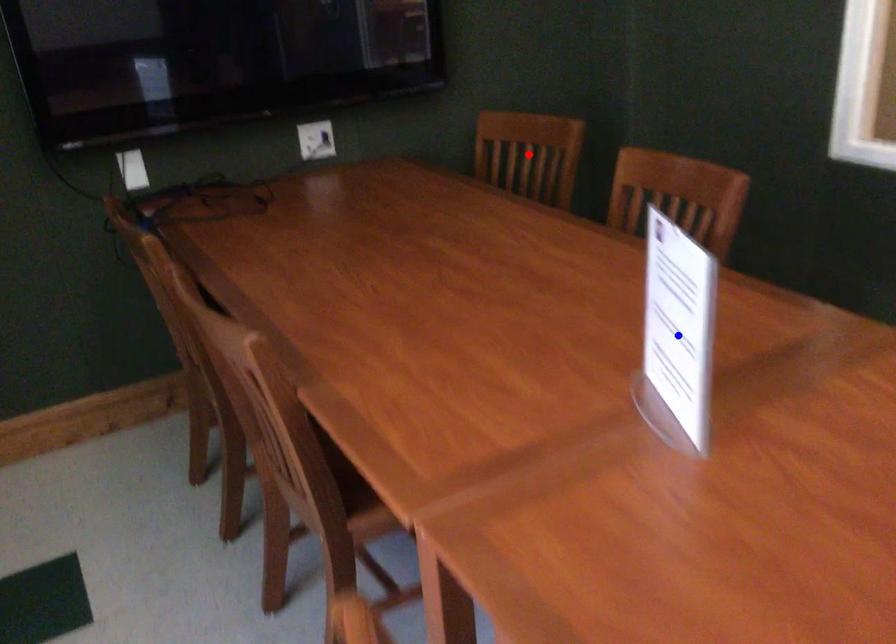
Question: In the image, two points are highlighted. Which point is nearer to the camera? Reply with the corresponding letter.

Choices:
 (A) blue point
 (B) red point

Answer: (A)